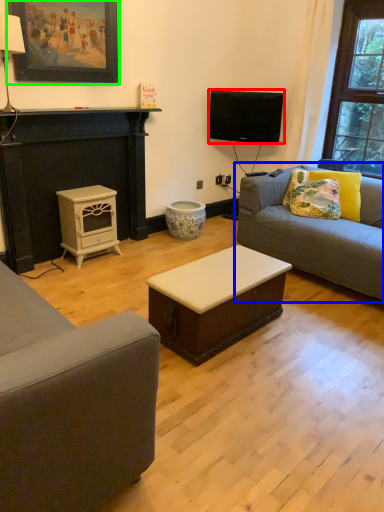
Question: Estimate the real-world distances between objects in this image. Which object is farther from television (highlighted by a red box), studio couch (highlighted by a blue box) or picture frame (highlighted by a green box)?

Choices:
 (A) studio couch
 (B) picture frame

Answer: (B)